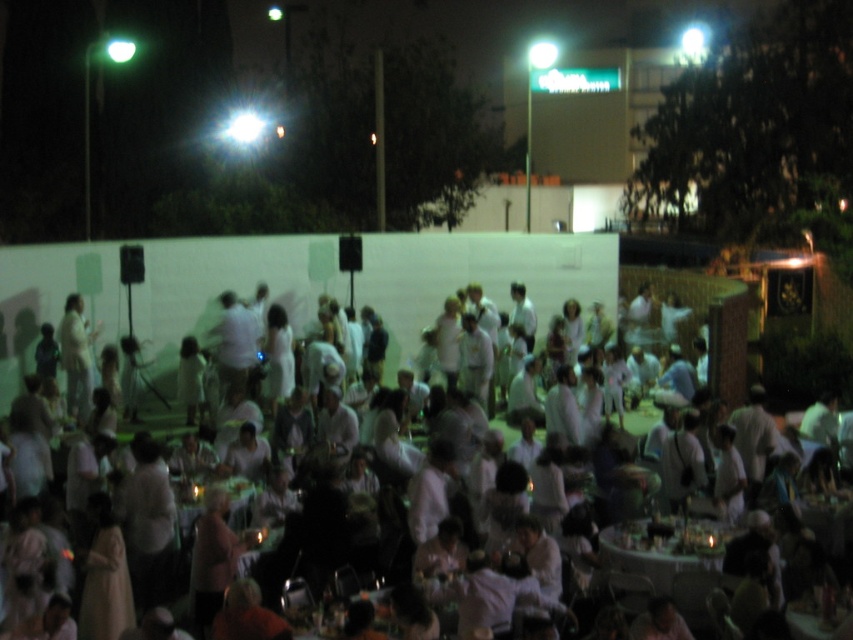
You are a photographer at the event and want to capture a photo of both the white matte dress at center and the wooden round table at center. Considering their sizes, which one should you focus on to ensure they both fit in the frame without cropping?

The white matte dress at center is wider than the wooden round table at center, so you should focus on the white matte dress at center to ensure both fit in the frame without cropping.

You are at the event and want to move from your current position to the exit, which is located at point (657,566). There is an obstacle at point (28,316). Will you have to go around the obstacle to reach the exit?

Yes, you will have to go around the obstacle at point (28,316) because it is behind point (657,566), meaning it lies between your current position and the exit.

You are attending a Diner en Blanc event and notice the white matte dress at center and the wooden round table at center. Which object is closer to you?

The white matte dress at center is closer to you because the wooden round table at center is behind it.